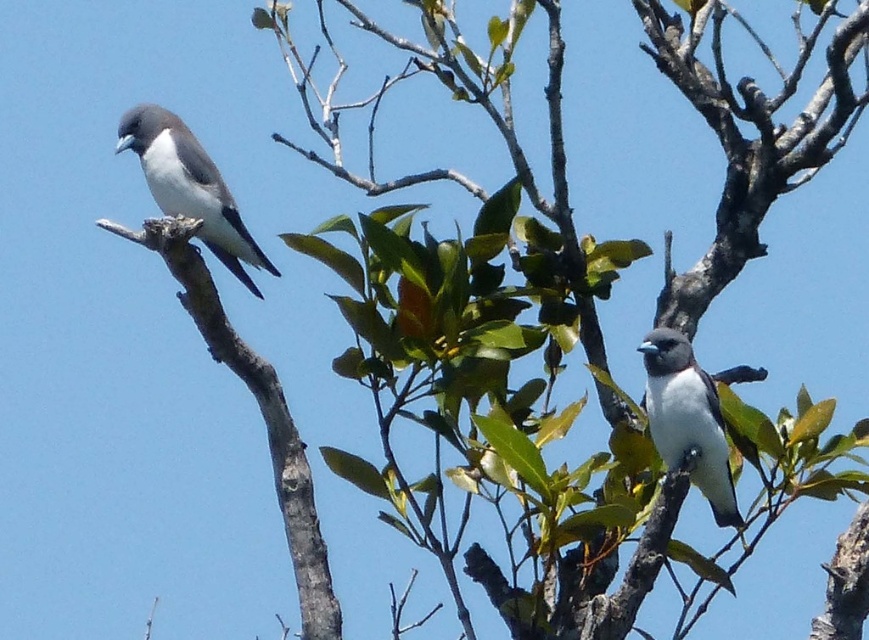
You are an ornithologist observing two birds on a tree branch. You notice a white glossy bird at upper left and a white matte bird at center. Which bird is located more to the left?

The white glossy bird at upper left is more to the left than the white matte bird at center.

You are a birdwatcher trying to capture both birds in a single photo. Your camera has a lens that can focus on objects within a 30 inch range. Can you fit both the white glossy bird at upper left and the white matte bird at center into the frame without moving the camera?

The white glossy bird at upper left and white matte bird at center are 35.20 inches apart. Since the distance between them exceeds the 30 inch range of the camera lens, you cannot fit both birds into the frame without moving the camera.